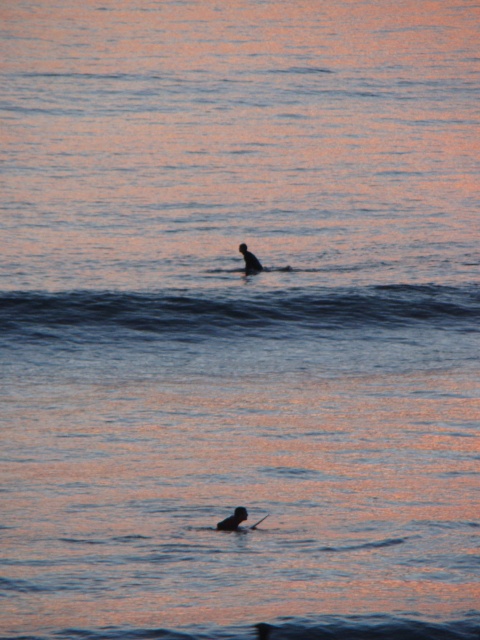
You are planning to take a surfboard out into the water. You have two options available in the image. Which one is narrower between the silhouette rubber surfboard at lower center and the silhouette surfboard at center?

The silhouette rubber surfboard at lower center is narrower than the silhouette surfboard at center.

You are standing on the beach and see the point marked at coordinate (250, 259) in the image. What object is located at that point?

A: The point at coordinate (250, 259) marks the silhouette surfboard at center.

You are a lifeguard on duty and need to reach both the silhouette rubber surfboard at lower center and the silhouette surfboard at center. Given that your maximum swimming distance is 30 feet, can you safely retrieve both without exceeding your limit?

The silhouette rubber surfboard at lower center and silhouette surfboard at center are 33.89 feet apart from each other. Since your maximum swimming distance is 30 feet, you cannot safely retrieve both without exceeding your limit.